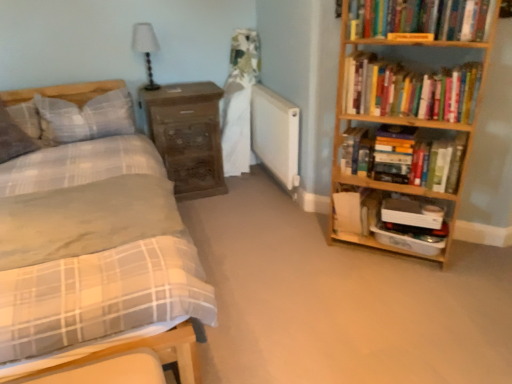
Where is `vacant space that's between wooden carved chest of drawers at center and wooden bookcase at right`? vacant space that's between wooden carved chest of drawers at center and wooden bookcase at right is located at coordinates (257, 213).